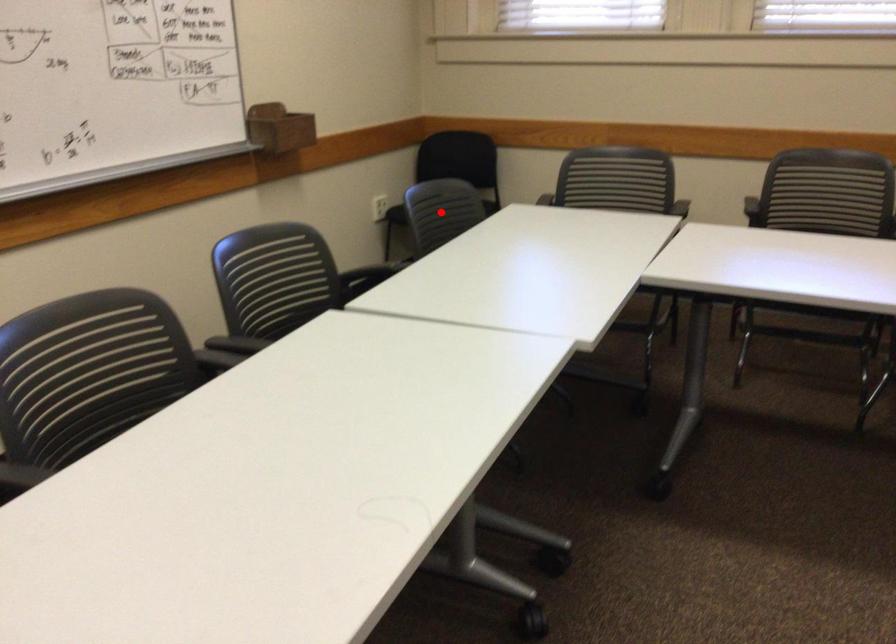
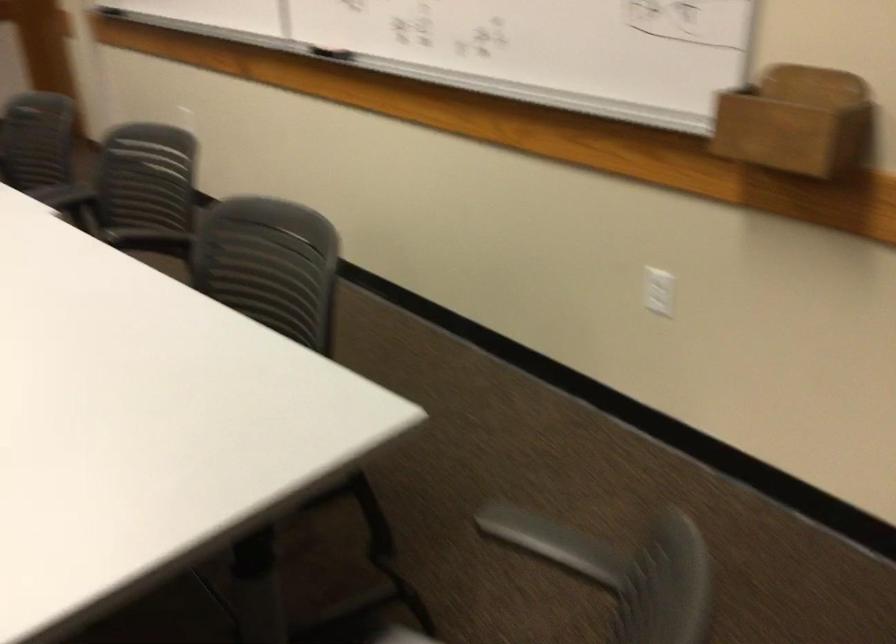
Question: I am providing you with two images of the same scene from different viewpoints. A red point is marked on the first image. Is the red point's position out of view in image 2?

Choices:
 (A) Yes
 (B) No

Answer: (A)